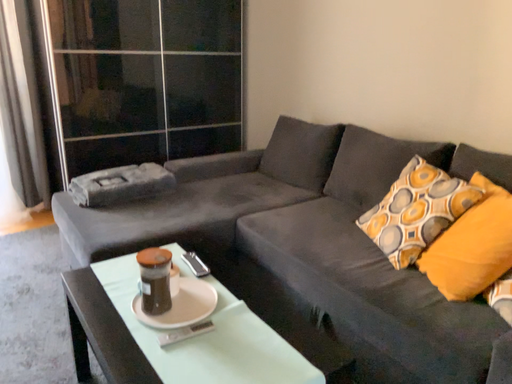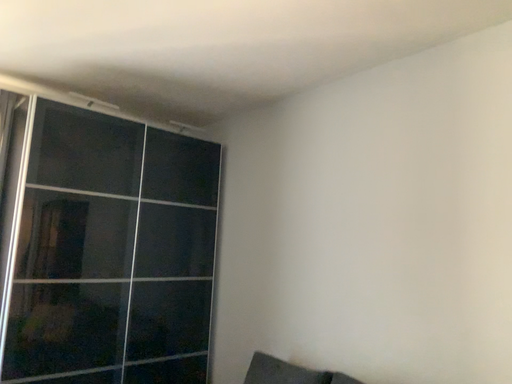
Question: How did the camera likely rotate when shooting the video?

Choices:
 (A) rotated upward
 (B) rotated downward

Answer: (A)